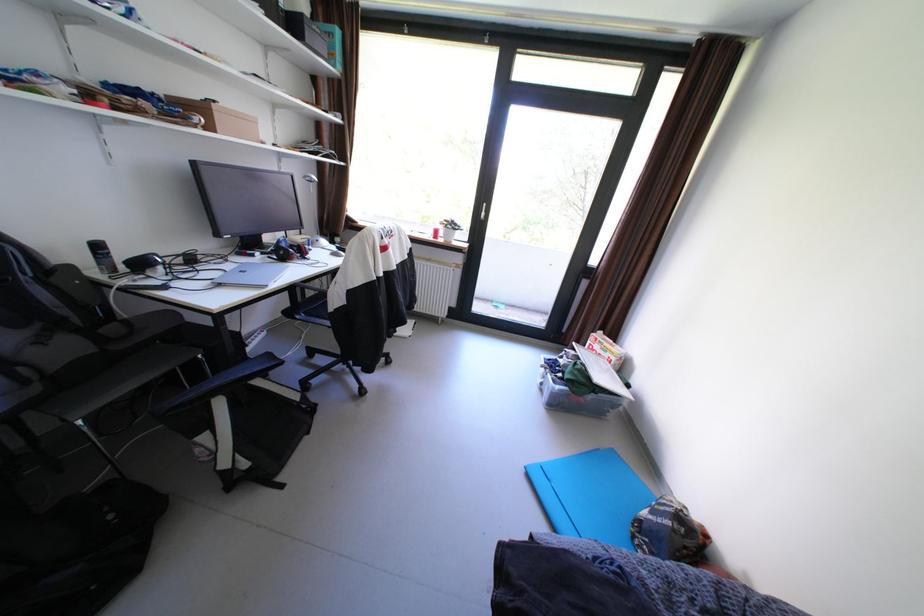
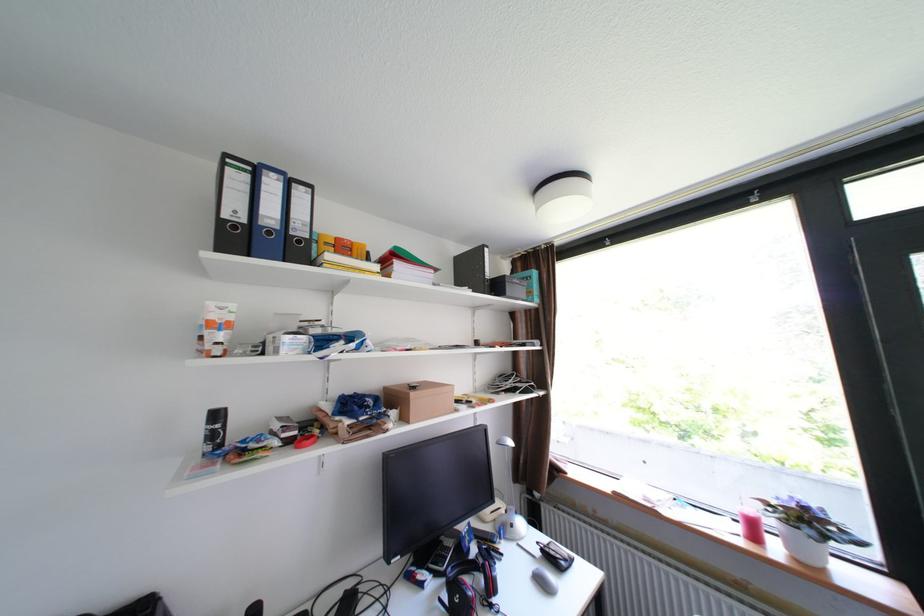
Find the pixel in the second image that matches (347,246) in the first image.

(553, 551)